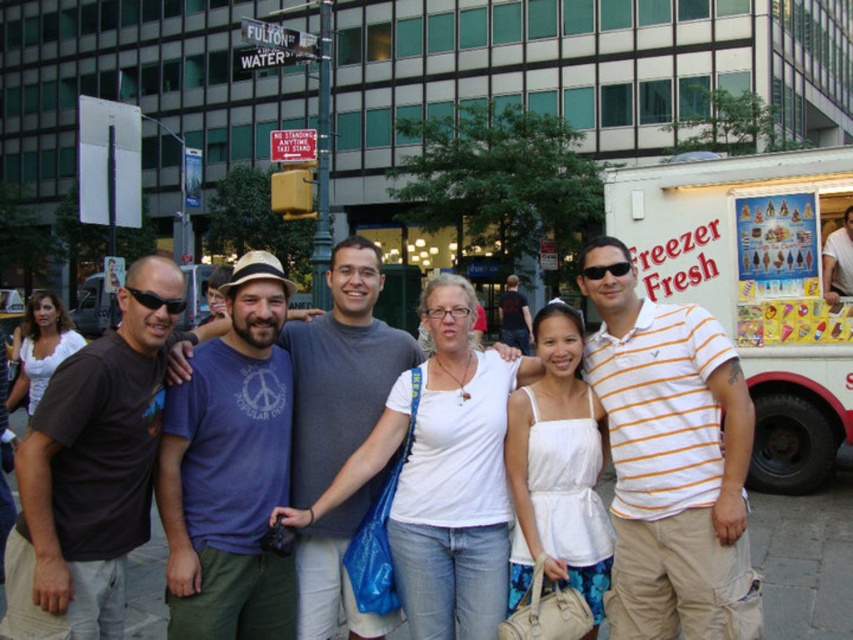
Question: Is white cardboard freezer fresh at right positioned at the back of matte white shirt at center?

Choices:
 (A) no
 (B) yes

Answer: (B)

Question: Among these objects, which one is nearest to the camera?

Choices:
 (A) matte white shirt at center
 (B) white cardboard freezer fresh at right

Answer: (A)

Question: Does white cardboard freezer fresh at right appear on the left side of matte white shirt at center?

Choices:
 (A) no
 (B) yes

Answer: (A)

Question: Which point is farther to the camera?

Choices:
 (A) matte white shirt at center
 (B) white cardboard freezer fresh at right

Answer: (B)

Question: Can you confirm if white cardboard freezer fresh at right is positioned above matte white shirt at center?

Choices:
 (A) no
 (B) yes

Answer: (B)

Question: Among these points, which one is nearest to the camera?

Choices:
 (A) (740, 372)
 (B) (804, 433)

Answer: (A)